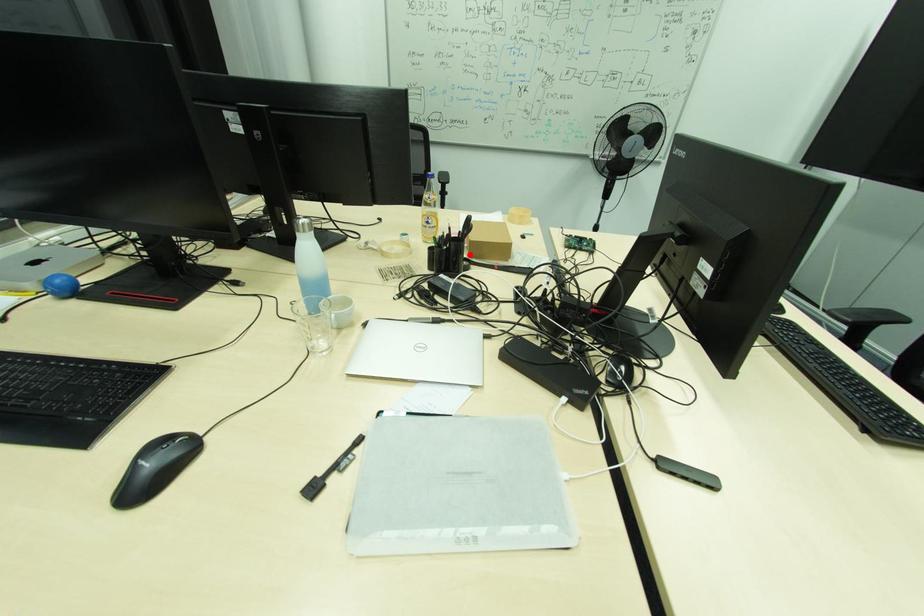
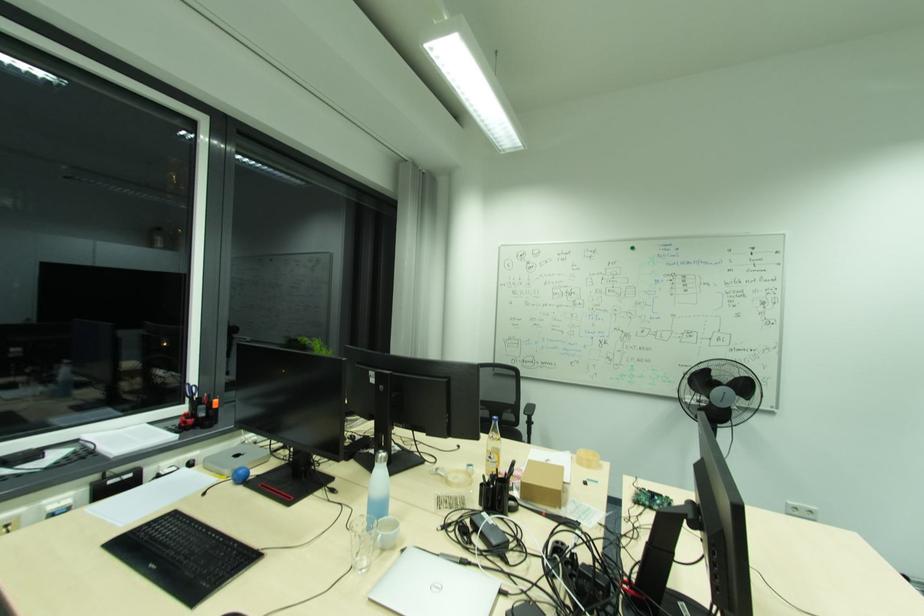
Question: A red point is marked in image1. In image2, is the corresponding 3D point closer to the camera or farther? Reply with the corresponding letter.

Choices:
 (A) The corresponding 3D point is closer.
 (B) The corresponding 3D point is farther.

Answer: (B)